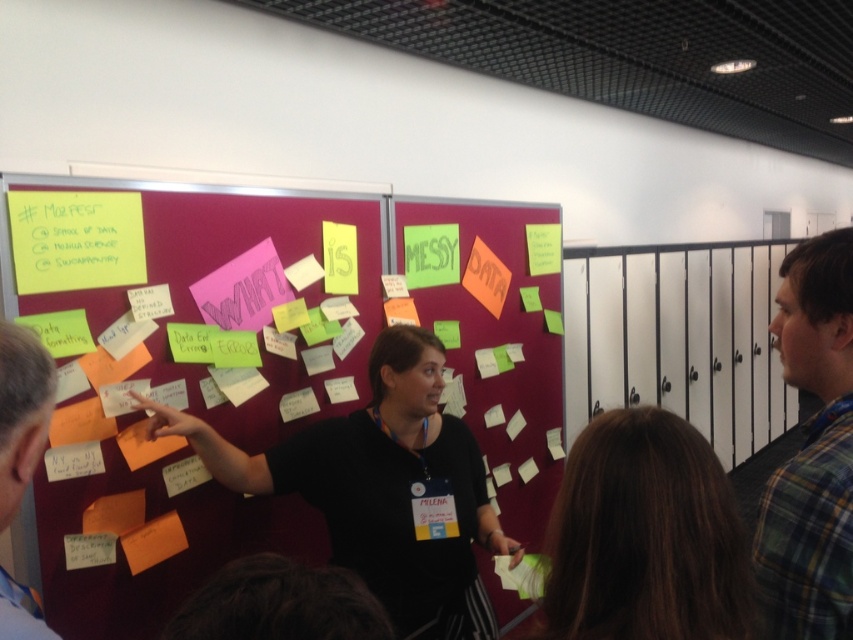
You are standing in front of the large red corkboard with sticky notes and want to touch both the point at coordinates point (660, 630) and point (778, 634). Which point will your hand reach first?

Point (660, 630) is closer to the viewer than point (778, 634), so you will reach point (660, 630) first.

You are standing in a room and see the maroon fabric bulletin board at center. If you want to reach it without moving your feet, what is the minimum distance you need to extend your arm?

The maroon fabric bulletin board at center is 4.95 feet away from the viewer. To reach it without moving your feet, you would need to extend your arm at least 4.95 feet.

Based on the scene description, where is the flannel shirt at right located in terms of its 2D coordinates?

The flannel shirt at right is located at the 2D coordinates of point (811, 451).